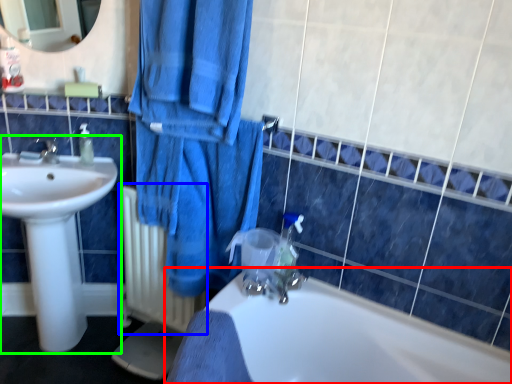
Question: Which is farther away from bathtub (highlighted by a red box)? radiator (highlighted by a blue box) or sink (highlighted by a green box)?

Choices:
 (A) radiator
 (B) sink

Answer: (B)